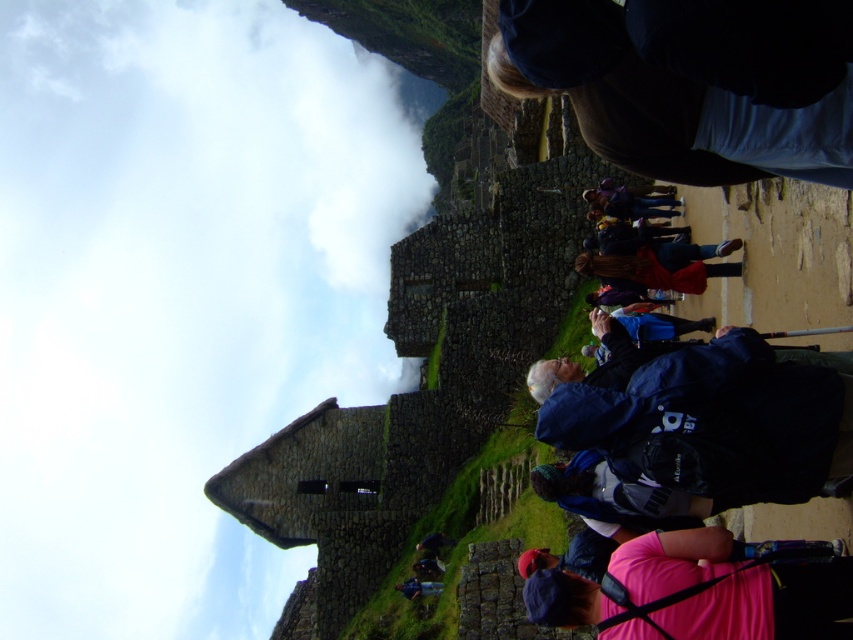
Question: From the image, what is the correct spatial relationship of blue fabric backpack at lower right in relation to pink fabric at lower right?

Choices:
 (A) left
 (B) right

Answer: (B)

Question: Which object appears farthest from the camera in this image?

Choices:
 (A) white fluffy cloud at upper left
 (B) blue fabric backpack at lower right

Answer: (A)

Question: Can you confirm if white fluffy cloud at upper left is smaller than blue fabric backpack at lower right?

Choices:
 (A) yes
 (B) no

Answer: (B)

Question: Which is farther from the blue fabric backpack at lower right?

Choices:
 (A) white fluffy cloud at upper left
 (B) pink fabric at lower right

Answer: (A)

Question: From the image, what is the correct spatial relationship of dark blue fabric at upper right in relation to pink fabric at lower right?

Choices:
 (A) above
 (B) below

Answer: (A)

Question: Estimate the real-world distances between objects in this image. Which object is closer to the pink fabric at lower right?

Choices:
 (A) blue fabric backpack at lower right
 (B) white fluffy cloud at upper left
 (C) dark blue fabric at upper right

Answer: (A)